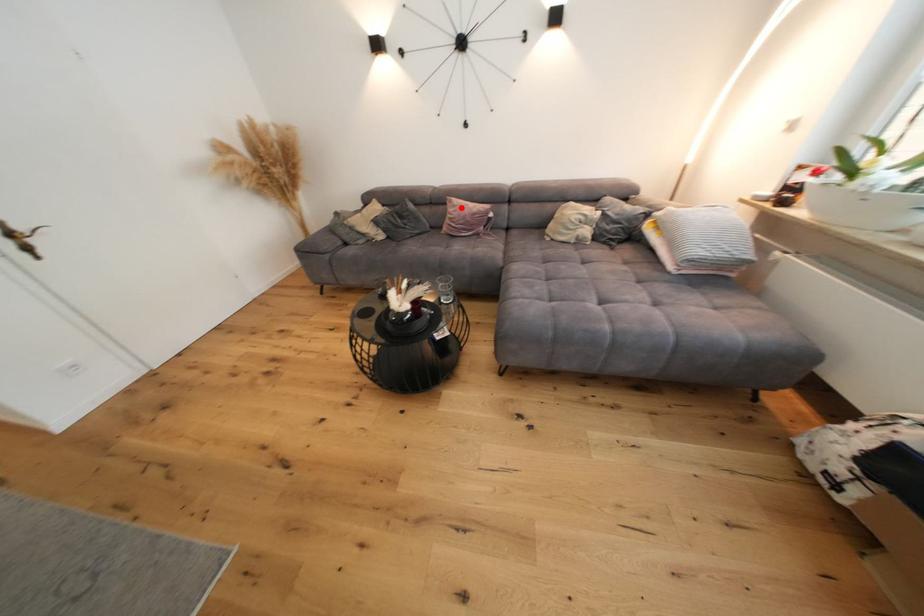
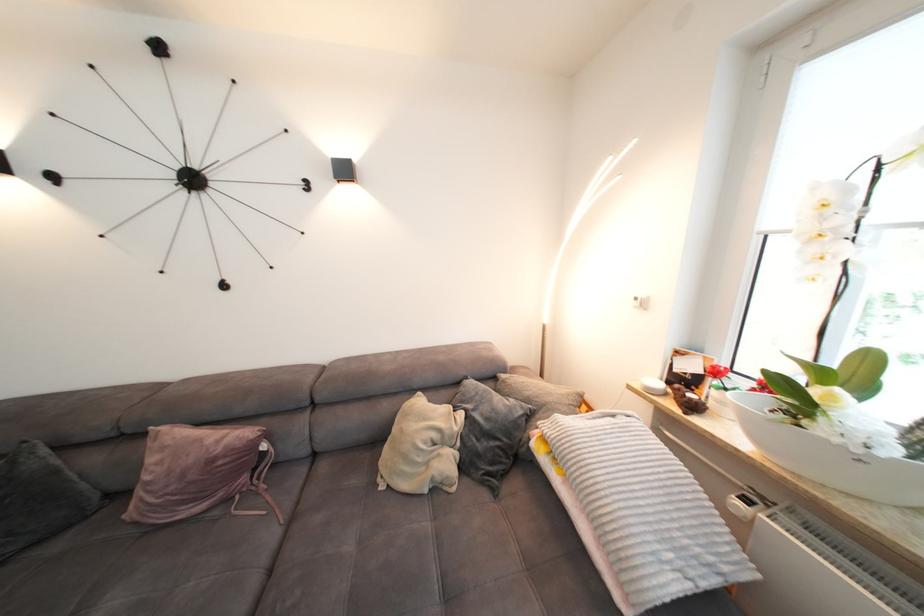
Find the pixel in the second image that matches the highlighted location in the first image.

(171, 448)